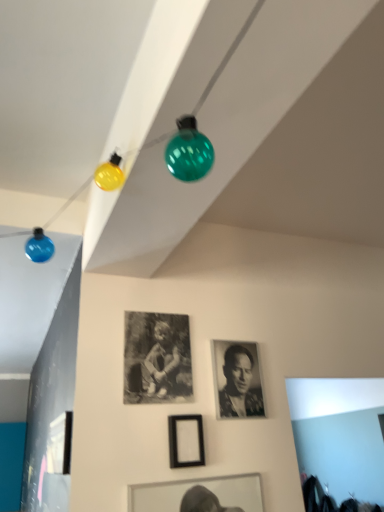
Question: Is black matte picture frame at center, positioned as the 1th picture frame in right-to-left order, further to the viewer compared to black matte photo frame at center, which is counted as the second picture frame, starting from the left?

Choices:
 (A) no
 (B) yes

Answer: (A)

Question: Can you confirm if black matte picture frame at center, positioned as the 1th picture frame in right-to-left order, is thinner than black matte photo frame at center, which is counted as the second picture frame, starting from the left?

Choices:
 (A) yes
 (B) no

Answer: (B)

Question: Is black matte picture frame at center, positioned as the 1th picture frame in right-to-left order, looking in the opposite direction of black matte photo frame at center, which is counted as the 2th picture frame, starting from the right?

Choices:
 (A) yes
 (B) no

Answer: (B)

Question: Can we say black matte picture frame at center, arranged as the 3th picture frame when viewed from the left, lies outside black matte photo frame at center, which is counted as the 2th picture frame, starting from the right?

Choices:
 (A) yes
 (B) no

Answer: (A)

Question: Does black matte picture frame at center, arranged as the 3th picture frame when viewed from the left, have a greater width compared to black matte photo frame at center, which is counted as the 2th picture frame, starting from the right?

Choices:
 (A) yes
 (B) no

Answer: (A)

Question: In the image, is black and white photograph at center positioned in front of or behind black matte picture frame at center, arranged as the 3th picture frame when viewed from the left?

Choices:
 (A) front
 (B) behind

Answer: (B)

Question: From their relative heights in the image, would you say black and white photograph at center is taller or shorter than black matte picture frame at center, positioned as the 1th picture frame in right-to-left order?

Choices:
 (A) short
 (B) tall

Answer: (B)

Question: Considering the positions of point (238, 360) and point (180, 463), is point (238, 360) closer or farther from the camera than point (180, 463)?

Choices:
 (A) closer
 (B) farther

Answer: (B)

Question: Would you say black and white photograph at center is to the left or to the right of black matte picture frame at center, positioned as the 1th picture frame in right-to-left order, in the picture?

Choices:
 (A) right
 (B) left

Answer: (A)

Question: Is black and white photograph at center taller or shorter than black matte photo frame at center, which is counted as the second picture frame, starting from the left?

Choices:
 (A) tall
 (B) short

Answer: (B)

Question: Looking at the image, does black and white photograph at center seem bigger or smaller compared to black matte photo frame at center, which is counted as the second picture frame, starting from the left?

Choices:
 (A) small
 (B) big

Answer: (A)

Question: In the image, is black and white photograph at center positioned in front of or behind black matte photo frame at center, which is counted as the 2th picture frame, starting from the right?

Choices:
 (A) front
 (B) behind

Answer: (B)

Question: From a real-world perspective, relative to black matte photo frame at center, which is counted as the 2th picture frame, starting from the right, is black and white photograph at center vertically above or below?

Choices:
 (A) above
 (B) below

Answer: (B)

Question: Is black matte photo frame at center, which is counted as the second picture frame, starting from the left, inside the boundaries of black and white photograph at center, or outside?

Choices:
 (A) outside
 (B) inside

Answer: (A)

Question: Is black matte photo frame at center, which is counted as the 2th picture frame, starting from the right, wider or thinner than black and white photograph at center?

Choices:
 (A) wide
 (B) thin

Answer: (B)